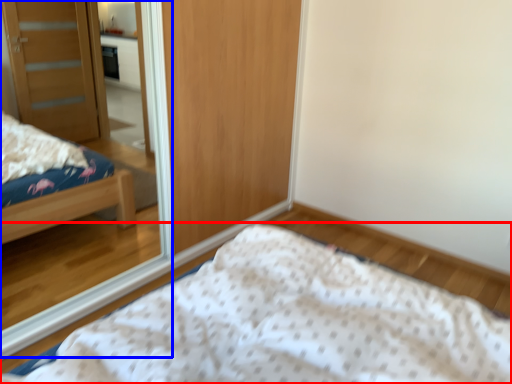
Question: Which object is closer to the camera taking this photo, bed (highlighted by a red box) or mirror (highlighted by a blue box)?

Choices:
 (A) bed
 (B) mirror

Answer: (A)